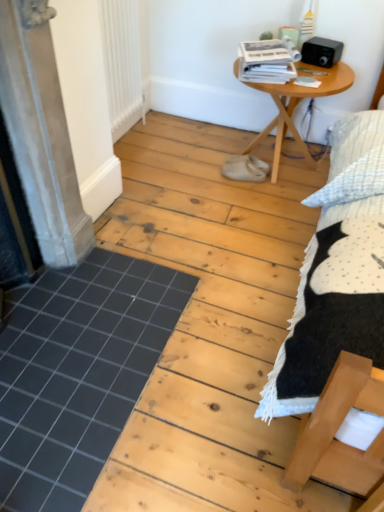
Find the location of a particular element. free space above black tile at lower left (from a real-world perspective) is located at coordinates (75, 343).